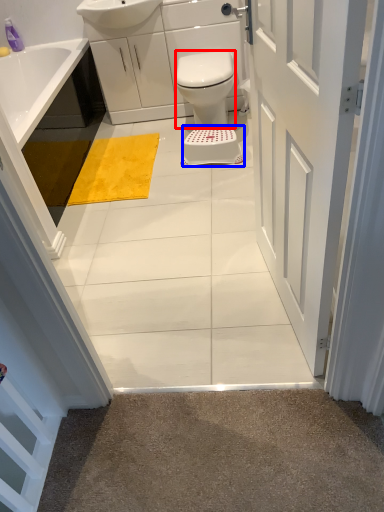
Question: Which object appears farthest to the camera in this image, bidet (highlighted by a red box) or stool (highlighted by a blue box)?

Choices:
 (A) bidet
 (B) stool

Answer: (B)